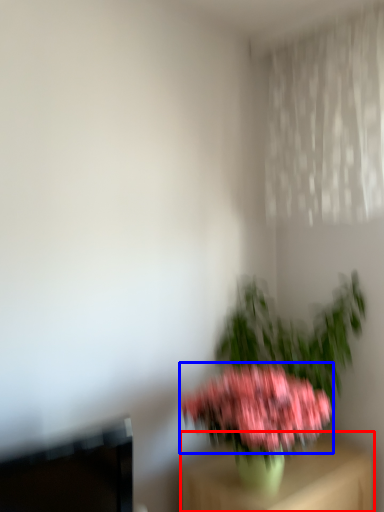
Question: Which of the following is the farthest to the observer, furniture (highlighted by a red box) or flower (highlighted by a blue box)?

Choices:
 (A) furniture
 (B) flower

Answer: (A)